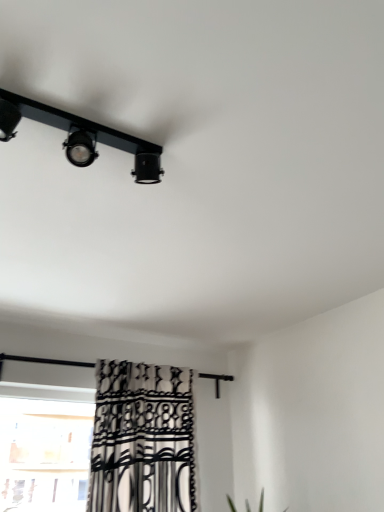
Question: Is black and white patterned curtain at lower left at the left side of black matte track light at upper left?

Choices:
 (A) yes
 (B) no

Answer: (B)

Question: Is black and white patterned curtain at lower left looking in the opposite direction of black matte track light at upper left?

Choices:
 (A) yes
 (B) no

Answer: (B)

Question: Considering the relative sizes of black and white patterned curtain at lower left and black matte track light at upper left in the image provided, is black and white patterned curtain at lower left thinner than black matte track light at upper left?

Choices:
 (A) no
 (B) yes

Answer: (A)

Question: Is black and white patterned curtain at lower left bigger than black matte track light at upper left?

Choices:
 (A) yes
 (B) no

Answer: (A)

Question: From the image's perspective, is black and white patterned curtain at lower left located beneath black matte track light at upper left?

Choices:
 (A) yes
 (B) no

Answer: (A)

Question: From a real-world perspective, is black and white patterned curtain at lower left below black matte track light at upper left?

Choices:
 (A) yes
 (B) no

Answer: (A)

Question: From a real-world perspective, is black matte track light at upper left physically below black and white patterned curtain at lower left?

Choices:
 (A) yes
 (B) no

Answer: (B)

Question: Is black matte track light at upper left positioned behind black and white patterned curtain at lower left?

Choices:
 (A) yes
 (B) no

Answer: (B)

Question: From the image's perspective, does black matte track light at upper left appear lower than black and white patterned curtain at lower left?

Choices:
 (A) no
 (B) yes

Answer: (A)

Question: Is black matte track light at upper left far from black and white patterned curtain at lower left?

Choices:
 (A) yes
 (B) no

Answer: (A)

Question: Is black matte track light at upper left not within black and white patterned curtain at lower left?

Choices:
 (A) yes
 (B) no

Answer: (A)

Question: Is black matte track light at upper left to the right of black and white patterned curtain at lower left from the viewer's perspective?

Choices:
 (A) yes
 (B) no

Answer: (B)

Question: Looking at their shapes, would you say black matte track light at upper left is wider or thinner than black and white patterned curtain at lower left?

Choices:
 (A) thin
 (B) wide

Answer: (A)